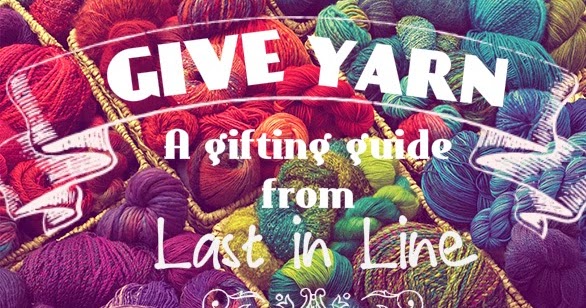
You are a GUI agent. You are given a task and a screenshot of the screen. Output one action in this format:
    pyautogui.click(x=<x>, y=<y>)
    Task: Click on the basket
    The height and width of the screenshot is (308, 586).
    Given the screenshot: What is the action you would take?
    pyautogui.click(x=49, y=233), pyautogui.click(x=77, y=232), pyautogui.click(x=193, y=205), pyautogui.click(x=306, y=25), pyautogui.click(x=386, y=133), pyautogui.click(x=419, y=197), pyautogui.click(x=580, y=72)